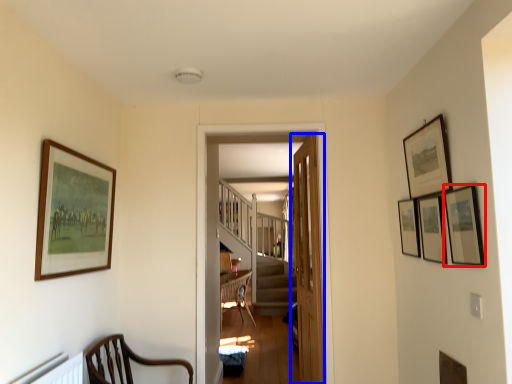
Question: Which point is closer to the camera, picture frame (highlighted by a red box) or door (highlighted by a blue box)?

Choices:
 (A) picture frame
 (B) door

Answer: (A)